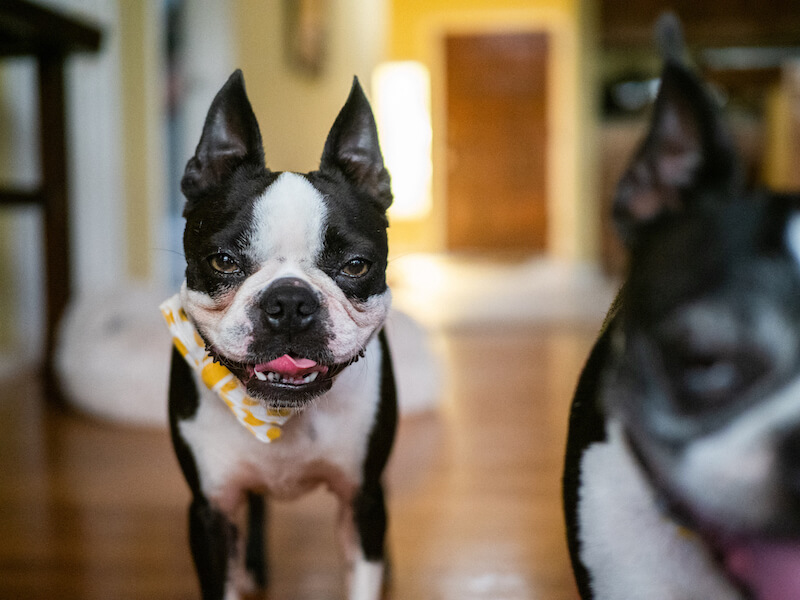
The image size is (800, 600). In order to click on wood floor in this screenshot , I will do `click(494, 213)`, `click(498, 75)`, `click(498, 392)`, `click(494, 496)`, `click(445, 484)`, `click(310, 543)`, `click(114, 505)`, `click(61, 458)`, `click(54, 543)`.